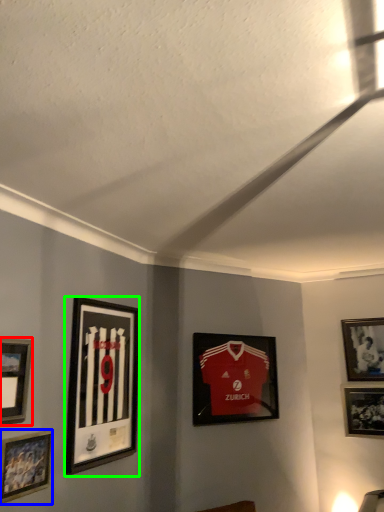
Question: Which object is the farthest from picture frame (highlighted by a red box)? Choose among these: picture frame (highlighted by a blue box) or picture frame (highlighted by a green box).

Choices:
 (A) picture frame
 (B) picture frame

Answer: (B)